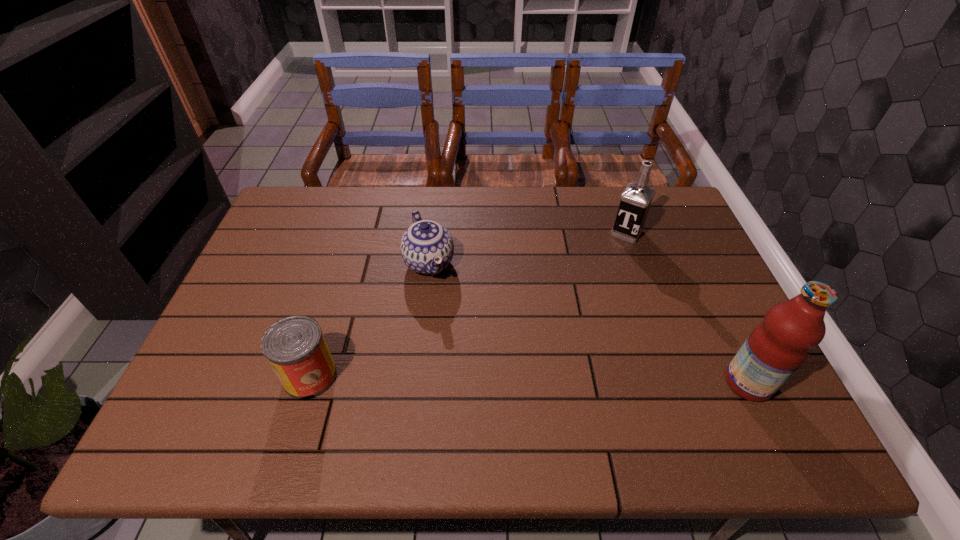
Find the location of a particular element. The height and width of the screenshot is (540, 960). free location located at the spout of the chinaware is located at coordinates (449, 323).

The width and height of the screenshot is (960, 540). What are the coordinates of `vacant point located at the spout of the chinaware` in the screenshot? It's located at (479, 392).

Locate an element on the screen. Image resolution: width=960 pixels, height=540 pixels. vacant space located at the spout of the chinaware is located at coordinates (467, 363).

Find the location of a particular element. The height and width of the screenshot is (540, 960). object located in the far edge section of the desktop is located at coordinates (636, 199).

The image size is (960, 540). I want to click on can at the near edge, so click(295, 347).

Image resolution: width=960 pixels, height=540 pixels. Identify the location of fruit juice located at the near edge. (777, 347).

In order to click on fruit juice that is at the right edge in this screenshot , I will do `click(777, 347)`.

Locate an element on the screen. The width and height of the screenshot is (960, 540). vodka present at the right edge is located at coordinates (636, 199).

At what (x,y) coordinates should I click in order to perform the action: click on object positioned at the far right corner. Please return your answer as a coordinate pair (x, y). Looking at the image, I should click on (636, 199).

At what (x,y) coordinates should I click in order to perform the action: click on object at the near right corner. Please return your answer as a coordinate pair (x, y). The width and height of the screenshot is (960, 540). Looking at the image, I should click on (777, 347).